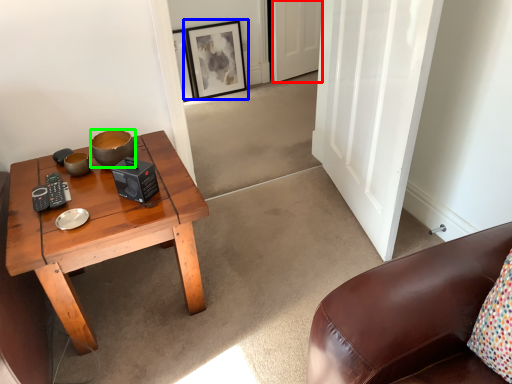
Question: Which object is the farthest from door (highlighted by a red box)? Choose among these: picture frame (highlighted by a blue box) or bowl (highlighted by a green box).

Choices:
 (A) picture frame
 (B) bowl

Answer: (B)